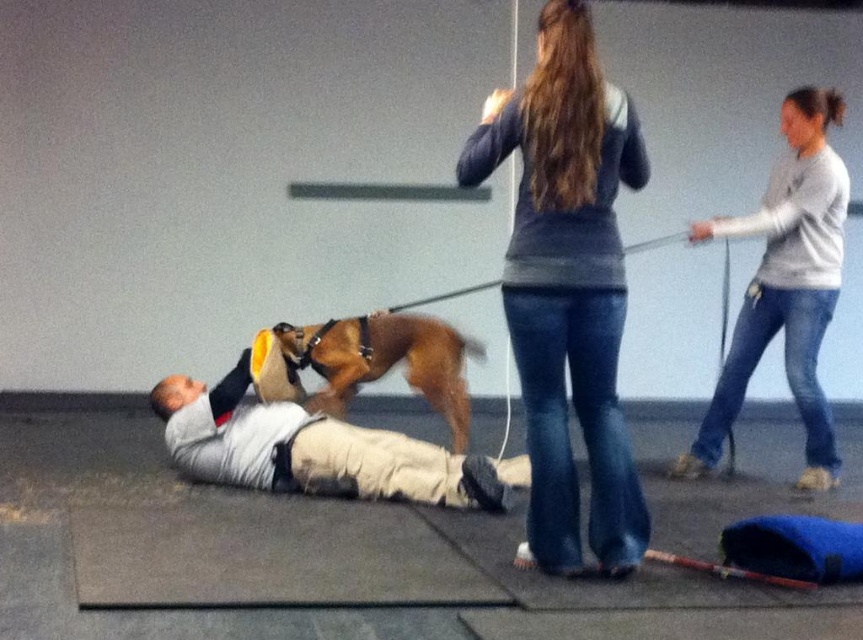
You are navigating a small robot through the training area. The robot needs to travel from the point at coordinates point [263,458] to the point at coordinates point [356,385]. According to the scene description, is the destination point closer to the robot than the starting point?

Point [263,458] is in front of point [356,385], so the destination point is closer to the robot than the starting point.

You are a fashion designer analyzing clothing thickness in an image. You see a gray sweater at center and a light gray fabric shirt at center. Which clothing item is thinner?

The gray sweater at center is thinner than the light gray fabric shirt at center according to the description.